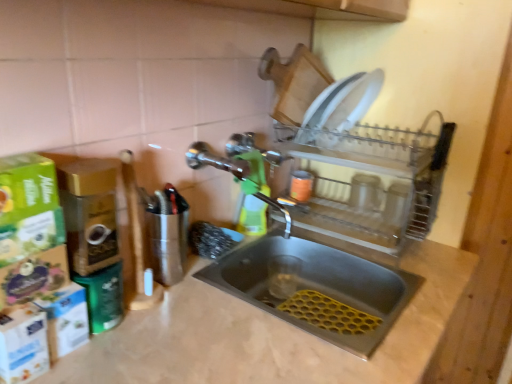
Question: Is polished chrome tap at center completely or partially inside beige marble counter top at center?

Choices:
 (A) no
 (B) yes

Answer: (A)

Question: From the image's perspective, is beige marble counter top at center above polished chrome tap at center?

Choices:
 (A) no
 (B) yes

Answer: (A)

Question: From a real-world perspective, is beige marble counter top at center physically below polished chrome tap at center?

Choices:
 (A) no
 (B) yes

Answer: (B)

Question: Does beige marble counter top at center have a greater height compared to polished chrome tap at center?

Choices:
 (A) yes
 (B) no

Answer: (A)

Question: Is beige marble counter top at center bigger than polished chrome tap at center?

Choices:
 (A) no
 (B) yes

Answer: (B)

Question: Choose the correct answer: Is beige marble counter top at center inside polished chrome tap at center or outside it?

Choices:
 (A) inside
 (B) outside

Answer: (B)

Question: In the image, is beige marble counter top at center on the left side or the right side of polished chrome tap at center?

Choices:
 (A) left
 (B) right

Answer: (B)

Question: Considering the positions of beige marble counter top at center and polished chrome tap at center in the image, is beige marble counter top at center bigger or smaller than polished chrome tap at center?

Choices:
 (A) big
 (B) small

Answer: (A)

Question: From their relative heights in the image, would you say beige marble counter top at center is taller or shorter than polished chrome tap at center?

Choices:
 (A) tall
 (B) short

Answer: (A)

Question: From a real-world perspective, relative to polished chrome tap at center, is green plastic spray bottle at center vertically above or below?

Choices:
 (A) below
 (B) above

Answer: (A)

Question: From their relative heights in the image, would you say green plastic spray bottle at center is taller or shorter than polished chrome tap at center?

Choices:
 (A) tall
 (B) short

Answer: (A)

Question: Is green plastic spray bottle at center to the left or to the right of polished chrome tap at center in the image?

Choices:
 (A) right
 (B) left

Answer: (A)

Question: Is green plastic spray bottle at center wider or thinner than polished chrome tap at center?

Choices:
 (A) thin
 (B) wide

Answer: (A)

Question: From a real-world perspective, relative to green plastic spray bottle at center, is clear plastic dish rack at upper right vertically above or below?

Choices:
 (A) below
 (B) above

Answer: (B)

Question: Considering the positions of clear plastic dish rack at upper right and green plastic spray bottle at center in the image, is clear plastic dish rack at upper right bigger or smaller than green plastic spray bottle at center?

Choices:
 (A) small
 (B) big

Answer: (B)